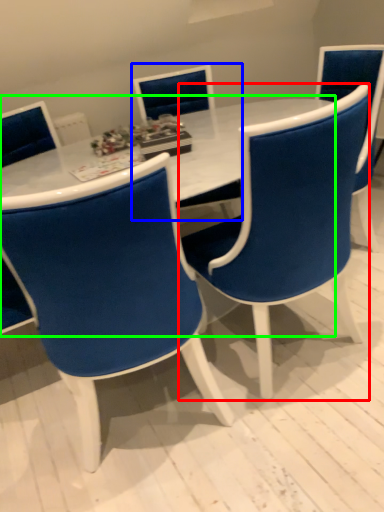
Question: Which is nearer to the chair (highlighted by a red box)? chair (highlighted by a blue box) or table (highlighted by a green box).

Choices:
 (A) chair
 (B) table

Answer: (B)